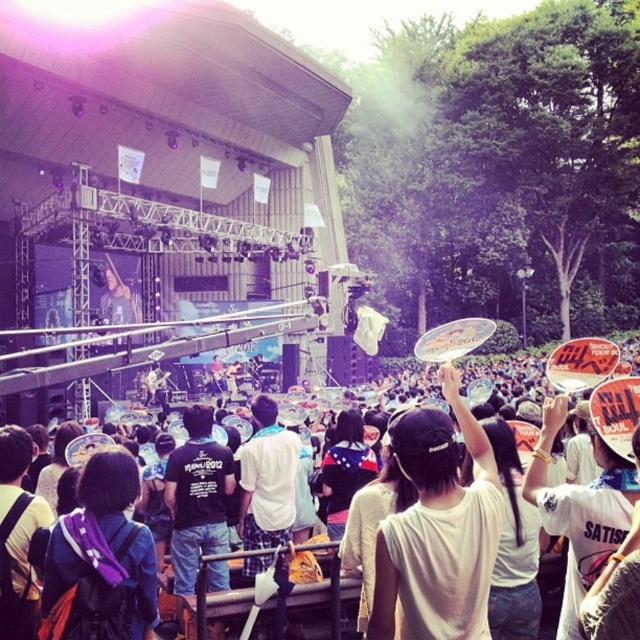
Question: Based on their relative distances, which object is nearer to the white plastic frisbee at upper center?

Choices:
 (A) white matte t-shirt at center
 (B) white cotton shirt at center
 (C) purple fabric backpack at center

Answer: (B)

Question: Considering the relative positions of purple fabric backpack at center and white plastic frisbee at upper center in the image provided, where is purple fabric backpack at center located with respect to white plastic frisbee at upper center?

Choices:
 (A) below
 (B) above

Answer: (A)

Question: Is purple fabric backpack at center smaller than white plastic frisbee at upper center?

Choices:
 (A) yes
 (B) no

Answer: (A)

Question: Considering the real-world distances, which object is farthest from the purple fabric backpack at center?

Choices:
 (A) white plastic frisbee at upper center
 (B) white cotton shirt at center

Answer: (A)

Question: Is white matte t-shirt at center positioned at the back of white plastic frisbee at upper center?

Choices:
 (A) no
 (B) yes

Answer: (A)

Question: Which of the following is the closest to the observer?

Choices:
 (A) white matte t-shirt at center
 (B) purple fabric backpack at center
 (C) white plastic frisbee at upper center

Answer: (B)